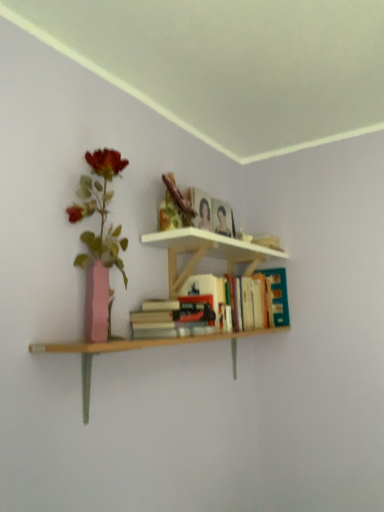
Question: Can you see hardcover book at upper right, which is the 1th book from back to front, touching hardcover book at center, acting as the 2th book starting from the back?

Choices:
 (A) yes
 (B) no

Answer: (A)

Question: From the image's perspective, does hardcover book at upper right, the second book when ordered from front to back, appear lower than hardcover book at center, acting as the 2th book starting from the back?

Choices:
 (A) yes
 (B) no

Answer: (B)

Question: From a real-world perspective, is hardcover book at upper right, which is the 1th book from back to front, below hardcover book at center, acting as the 2th book starting from the back?

Choices:
 (A) no
 (B) yes

Answer: (A)

Question: From the image's perspective, is hardcover book at upper right, which is the 1th book from back to front, on hardcover book at center, acting as the 2th book starting from the back?

Choices:
 (A) yes
 (B) no

Answer: (A)

Question: From a real-world perspective, is hardcover book at upper right, which is the 1th book from back to front, physically above hardcover book at center, acting as the 2th book starting from the back?

Choices:
 (A) yes
 (B) no

Answer: (A)

Question: Which is correct: hardcover book at upper right, the second book when ordered from front to back, is inside hardcover book at upper center, or outside of it?

Choices:
 (A) outside
 (B) inside

Answer: (A)

Question: Is hardcover book at upper right, which is the 1th book from back to front, taller or shorter than hardcover book at upper center?

Choices:
 (A) tall
 (B) short

Answer: (A)

Question: Considering the positions of point (190, 286) and point (205, 217), is point (190, 286) closer or farther from the camera than point (205, 217)?

Choices:
 (A) closer
 (B) farther

Answer: (A)

Question: In terms of size, does hardcover book at upper right, the second book when ordered from front to back, appear bigger or smaller than hardcover book at upper center?

Choices:
 (A) big
 (B) small

Answer: (A)

Question: In terms of width, does hardcover book at upper center look wider or thinner when compared to hardcover book at center, which ranks as the 1th book in front-to-back order?

Choices:
 (A) wide
 (B) thin

Answer: (B)

Question: Considering the positions of hardcover book at upper center and hardcover book at center, acting as the 2th book starting from the back, in the image, is hardcover book at upper center taller or shorter than hardcover book at center, acting as the 2th book starting from the back,?

Choices:
 (A) short
 (B) tall

Answer: (B)

Question: Does point (203, 211) appear closer or farther from the camera than point (160, 322)?

Choices:
 (A) closer
 (B) farther

Answer: (B)

Question: Relative to hardcover book at center, acting as the 2th book starting from the back, is hardcover book at upper center in front or behind?

Choices:
 (A) behind
 (B) front

Answer: (A)

Question: Relative to hardcover book at upper right, which is the 1th book from back to front, is hardcover book at upper center in front or behind?

Choices:
 (A) front
 (B) behind

Answer: (B)

Question: Looking at their shapes, would you say hardcover book at upper center is wider or thinner than hardcover book at upper right, the second book when ordered from front to back?

Choices:
 (A) thin
 (B) wide

Answer: (A)